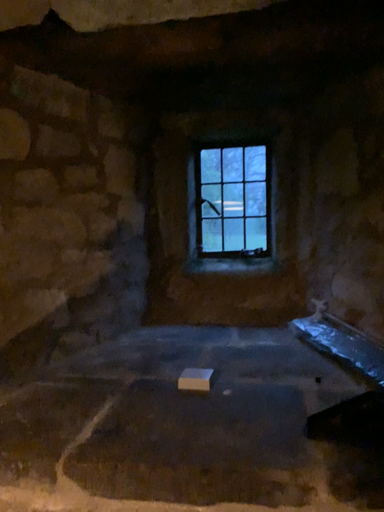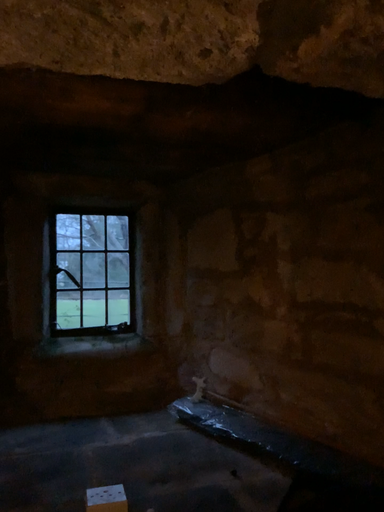
Question: How did the camera likely rotate when shooting the video?

Choices:
 (A) rotated downward
 (B) rotated upward

Answer: (B)